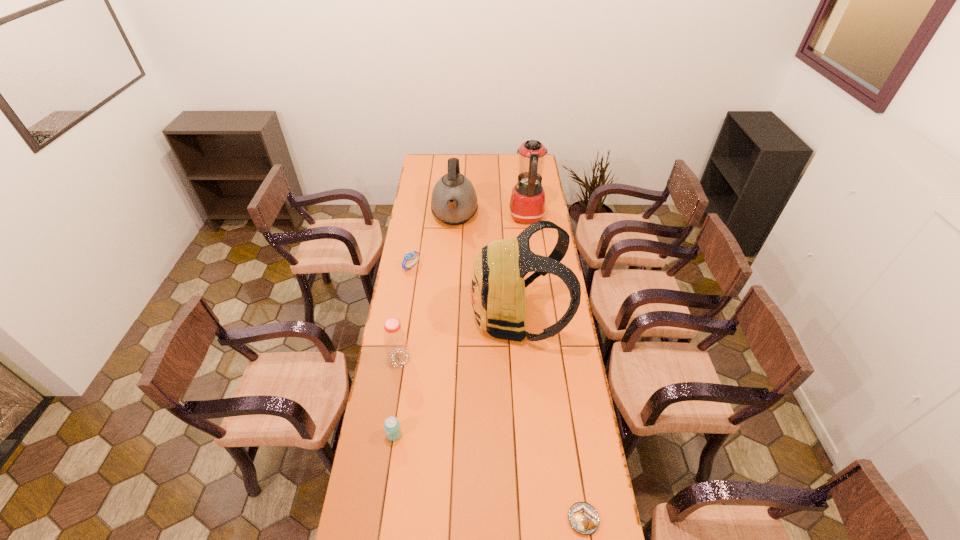
Locate an element on the screen. Image resolution: width=960 pixels, height=540 pixels. vacant region located 0.080m on the back of the pastry is located at coordinates (577, 476).

At what (x,y) coordinates should I click in order to perform the action: click on kettle at the left edge. Please return your answer as a coordinate pair (x, y). Looking at the image, I should click on (454, 201).

The width and height of the screenshot is (960, 540). What are the coordinates of `bottle at the left edge` in the screenshot? It's located at (395, 339).

You are a GUI agent. You are given a task and a screenshot of the screen. Output one action in this format:
    pyautogui.click(x=<x>, y=<y>)
    Task: Click on the beer can positioned at the left edge
    This screenshot has height=540, width=960.
    Given the screenshot: What is the action you would take?
    pyautogui.click(x=392, y=427)

Where is `watch at the left edge`? This screenshot has height=540, width=960. watch at the left edge is located at coordinates (408, 256).

You are a GUI agent. You are given a task and a screenshot of the screen. Output one action in this format:
    pyautogui.click(x=<x>, y=<y>)
    Task: Click on the food processor present at the right edge
    
    Given the screenshot: What is the action you would take?
    pyautogui.click(x=527, y=203)

I want to click on backpack located in the right edge section of the desktop, so tap(497, 284).

Where is `pastry that is at the right edge`? pastry that is at the right edge is located at coordinates (583, 518).

This screenshot has height=540, width=960. Identify the location of vacant space at the left edge of the desktop. (403, 307).

The image size is (960, 540). Find the location of `free location at the right edge of the desktop`. free location at the right edge of the desktop is located at coordinates (575, 344).